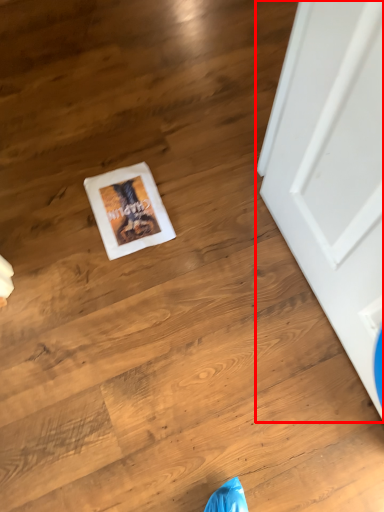
Question: Where is door (annotated by the red box) located in relation to postcard in the image?

Choices:
 (A) left
 (B) right

Answer: (B)